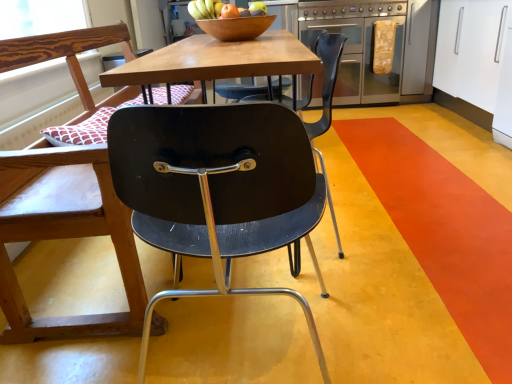
You are a GUI agent. You are given a task and a screenshot of the screen. Output one action in this format:
    pyautogui.click(x=<x>, y=<y>)
    Task: Click on the free space underneath matte black chair at center, the 2th chair from the left (from a real-world perspective)
    This screenshot has height=384, width=512.
    Given the screenshot: What is the action you would take?
    pyautogui.click(x=241, y=333)